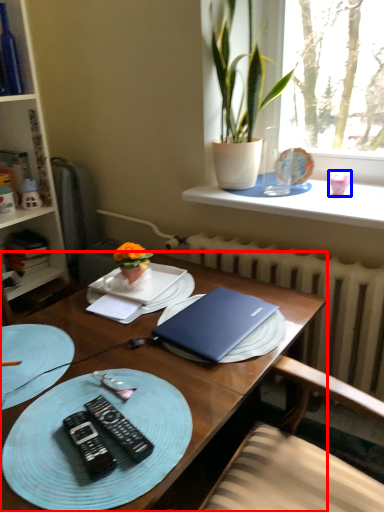
Question: Which object appears farthest to the camera in this image, desk (highlighted by a red box) or coffee cup (highlighted by a blue box)?

Choices:
 (A) desk
 (B) coffee cup

Answer: (B)